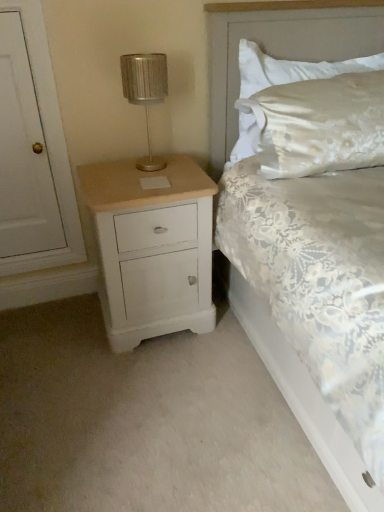
Question: Considering the relative sizes of satin white pillow at upper right and white lace bed at center in the image provided, is satin white pillow at upper right taller than white lace bed at center?

Choices:
 (A) no
 (B) yes

Answer: (A)

Question: Is satin white pillow at upper right with white lace bed at center?

Choices:
 (A) yes
 (B) no

Answer: (B)

Question: Considering the relative positions of satin white pillow at upper right and white lace bed at center in the image provided, is satin white pillow at upper right to the right of white lace bed at center from the viewer's perspective?

Choices:
 (A) no
 (B) yes

Answer: (B)

Question: Is there a large distance between satin white pillow at upper right and white lace bed at center?

Choices:
 (A) yes
 (B) no

Answer: (B)

Question: Does satin white pillow at upper right come in front of white lace bed at center?

Choices:
 (A) no
 (B) yes

Answer: (A)

Question: Would you say metallic silver table lamp at upper left is inside or outside white lace bed at center?

Choices:
 (A) outside
 (B) inside

Answer: (B)

Question: Considering the positions of metallic silver table lamp at upper left and white lace bed at center in the image, is metallic silver table lamp at upper left taller or shorter than white lace bed at center?

Choices:
 (A) tall
 (B) short

Answer: (B)

Question: Considering their positions, is metallic silver table lamp at upper left located in front of or behind white lace bed at center?

Choices:
 (A) behind
 (B) front

Answer: (A)

Question: Would you say metallic silver table lamp at upper left is to the left or to the right of white lace bed at center in the picture?

Choices:
 (A) right
 (B) left

Answer: (B)

Question: From the image's perspective, is white lace bed at center above or below satin white pillow at upper right?

Choices:
 (A) below
 (B) above

Answer: (A)

Question: Looking at their shapes, would you say white lace bed at center is wider or thinner than satin white pillow at upper right?

Choices:
 (A) wide
 (B) thin

Answer: (A)

Question: From their relative heights in the image, would you say white lace bed at center is taller or shorter than satin white pillow at upper right?

Choices:
 (A) tall
 (B) short

Answer: (A)

Question: Is white lace bed at center in front of or behind satin white pillow at upper right in the image?

Choices:
 (A) front
 (B) behind

Answer: (A)

Question: In terms of width, does white lace bed at center look wider or thinner when compared to metallic silver table lamp at upper left?

Choices:
 (A) thin
 (B) wide

Answer: (B)

Question: In terms of size, does white lace bed at center appear bigger or smaller than metallic silver table lamp at upper left?

Choices:
 (A) big
 (B) small

Answer: (A)